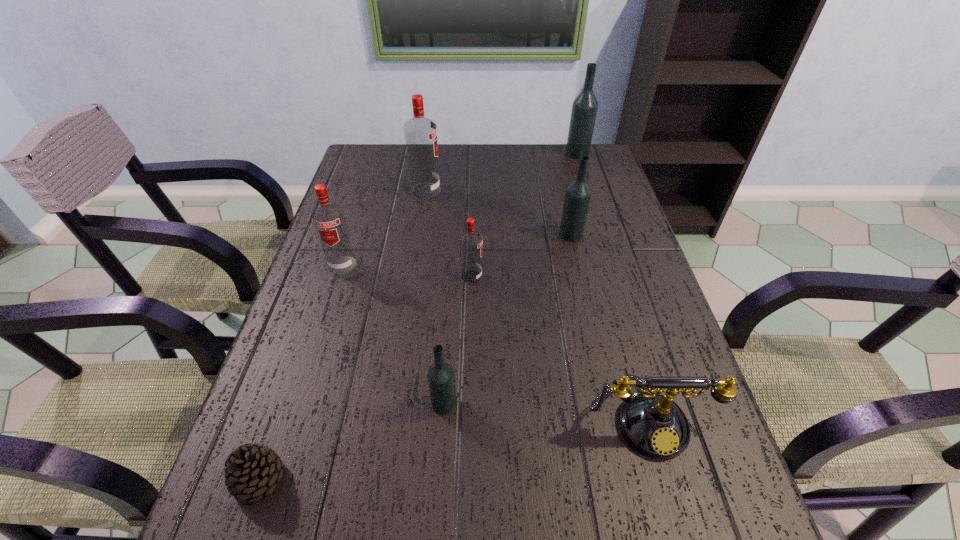
Image resolution: width=960 pixels, height=540 pixels. I want to click on the rightmost vodka, so click(x=584, y=109).

Locate an element on the screen. Image resolution: width=960 pixels, height=540 pixels. the farthest object is located at coordinates (584, 109).

Locate an element on the screen. The height and width of the screenshot is (540, 960). the second farthest object is located at coordinates (420, 133).

Identify the location of the second red vodka from left to right. Image resolution: width=960 pixels, height=540 pixels. (420, 133).

This screenshot has height=540, width=960. In order to click on the second nearest black vodka in this screenshot , I will do `click(577, 197)`.

Locate an element on the screen. This screenshot has width=960, height=540. the third farthest object is located at coordinates 577,197.

You are a GUI agent. You are given a task and a screenshot of the screen. Output one action in this format:
    pyautogui.click(x=<x>, y=<y>)
    Task: Click on the leftmost vodka
    
    Given the screenshot: What is the action you would take?
    pyautogui.click(x=329, y=220)

Locate an element on the screen. The width and height of the screenshot is (960, 540). the leftmost red vodka is located at coordinates (329, 220).

The image size is (960, 540). I want to click on the rightmost red vodka, so click(x=470, y=241).

Find the location of a particular element. The width and height of the screenshot is (960, 540). the smallest black vodka is located at coordinates (441, 380).